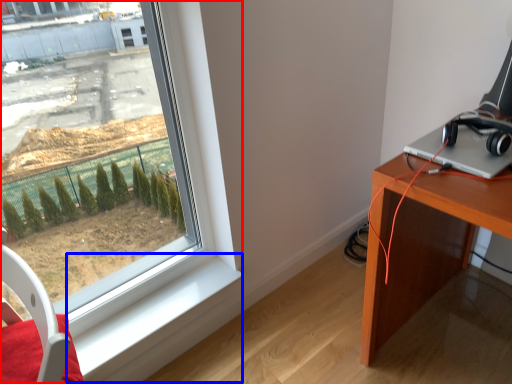
Question: Which of the following is the closest to the observer, window (highlighted by a red box) or window sill (highlighted by a blue box)?

Choices:
 (A) window
 (B) window sill

Answer: (A)